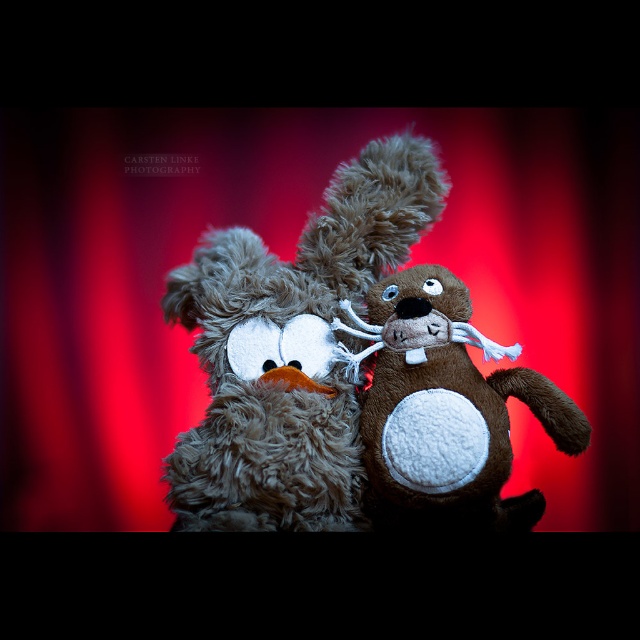
You are a photographer standing at a certain distance from the fuzzy brown teddy bear at center. If you want to take a closeup shot of the bear, should you move closer or farther away?

The fuzzy brown teddy bear at center is 3.82 feet from camera. To take a closeup shot, you should move closer to the bear.

You are arranging two plush toys on a shelf. You have a fuzzy brown teddy bear at center and a brown plush toy at center. According to the image, which toy should you place higher on the shelf to match the original arrangement?

The fuzzy brown teddy bear at center should be placed higher on the shelf because it is located above the brown plush toy at center in the original image.

You are standing in front of a wall with two plush toys. There is a grayish brown dog on the left and a brown bear on the right. A point at coordinates (x=291, y=349) is marked. Which plush toy is located at that point?

The fuzzy brown teddy bear at center is located at point (x=291, y=349).